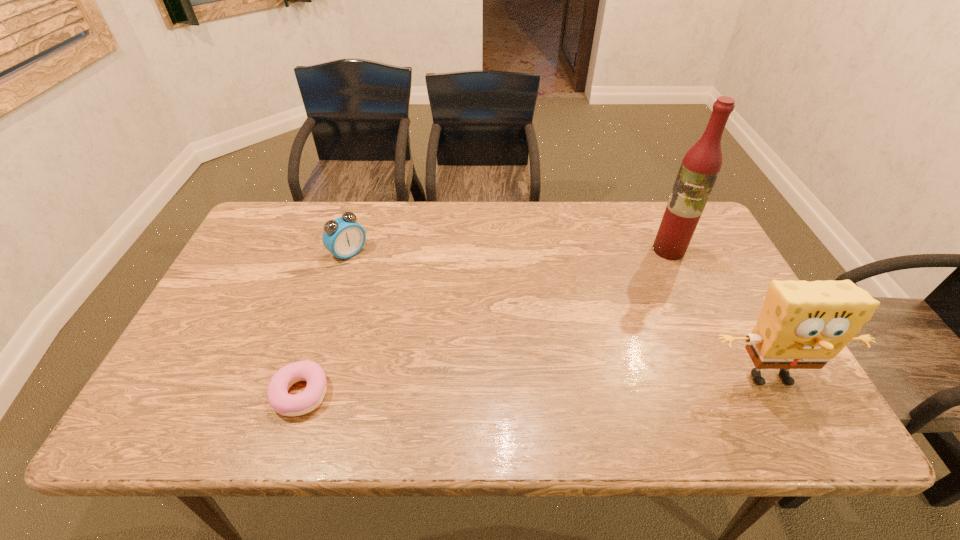
Locate an element on the screen. The image size is (960, 540). pastry is located at coordinates (283, 403).

Locate an element on the screen. This screenshot has height=540, width=960. the second tallest object is located at coordinates (803, 325).

This screenshot has height=540, width=960. I want to click on the third tallest object, so click(343, 237).

Identify the location of the tallest object. (700, 167).

The width and height of the screenshot is (960, 540). I want to click on free space located on the right of the pastry, so click(503, 393).

Where is `vacant position located 0.260m on the face of the alarm clock`? This screenshot has width=960, height=540. vacant position located 0.260m on the face of the alarm clock is located at coordinates (416, 310).

Where is `free space located 0.270m on the face of the alarm clock`? free space located 0.270m on the face of the alarm clock is located at coordinates (418, 312).

I want to click on blank area located 0.350m on the face of the alarm clock, so click(438, 329).

The height and width of the screenshot is (540, 960). Identify the location of vacant space located 0.390m on the label of the tallest object. (590, 336).

Where is `vacant space situated on the label of the tallest object`? vacant space situated on the label of the tallest object is located at coordinates (613, 311).